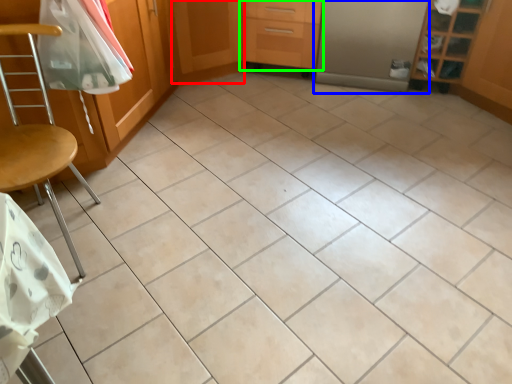
Question: Which object is positioned closest to screen door (highlighted by a red box)? Select from screen door (highlighted by a blue box) and drawer (highlighted by a green box).

Choices:
 (A) screen door
 (B) drawer

Answer: (B)